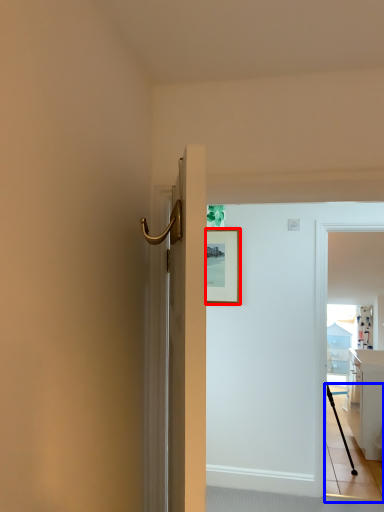
Question: Which object appears farthest to the camera in this image, picture frame (highlighted by a red box) or path (highlighted by a blue box)?

Choices:
 (A) picture frame
 (B) path

Answer: (A)